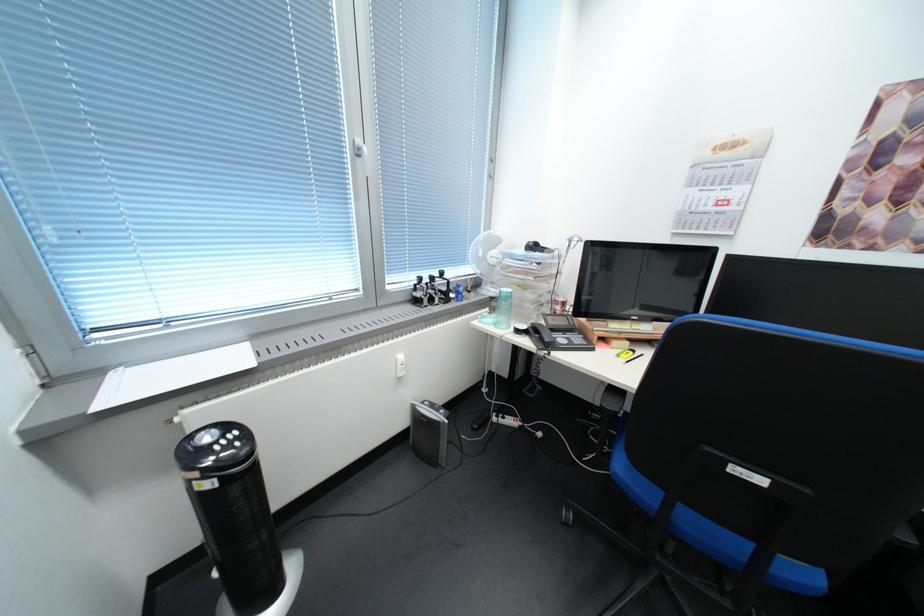
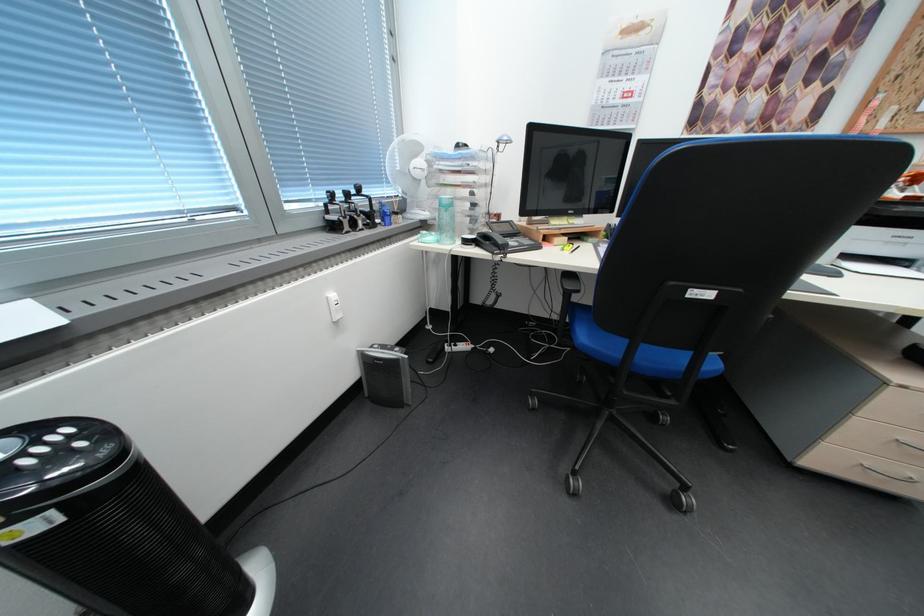
The point at (506, 325) is marked in the first image. Where is the corresponding point in the second image?

(450, 243)